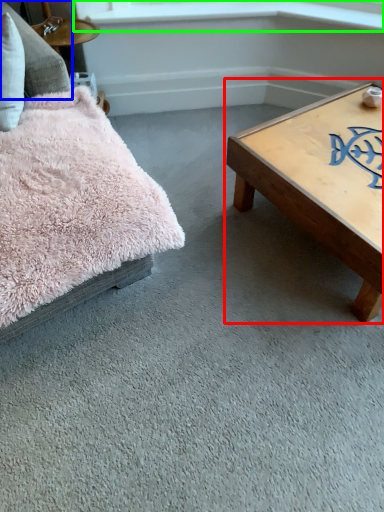
Question: Considering the real-world distances, which object is farthest from coffee table (highlighted by a red box)? pillow (highlighted by a blue box) or window sill (highlighted by a green box)?

Choices:
 (A) pillow
 (B) window sill

Answer: (A)